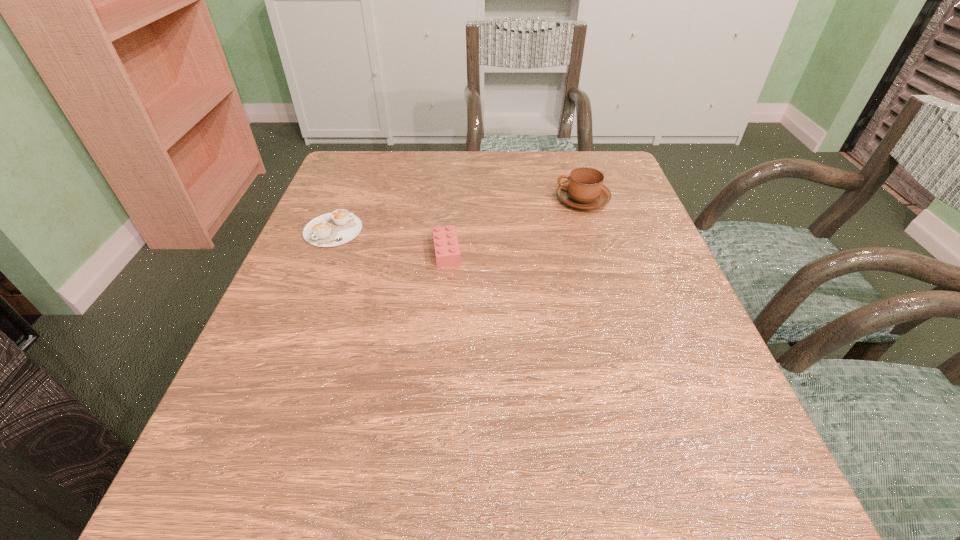
You are a GUI agent. You are given a task and a screenshot of the screen. Output one action in this format:
    pyautogui.click(x=<x>, y=<y>)
    Task: Click on the free space between the shortest object and the second object from left to right
    The width and height of the screenshot is (960, 540).
    Given the screenshot: What is the action you would take?
    pyautogui.click(x=390, y=241)

You are a GUI agent. You are given a task and a screenshot of the screen. Output one action in this format:
    pyautogui.click(x=<x>, y=<y>)
    Task: Click on the empty location between the right cappuccino and the leftmost object
    Image resolution: width=960 pixels, height=540 pixels.
    Given the screenshot: What is the action you would take?
    pyautogui.click(x=458, y=215)

Select which object appears as the closest to the Lego. Please provide its 2D coordinates. Your answer should be formatted as a tuple, i.e. [(x, y)], where the tuple contains the x and y coordinates of a point satisfying the conditions above.

[(332, 229)]

Locate which object is the second closest to the shortest object. Please provide its 2D coordinates. Your answer should be formatted as a tuple, i.e. [(x, y)], where the tuple contains the x and y coordinates of a point satisfying the conditions above.

[(584, 189)]

Find the location of a particular element. Image resolution: width=960 pixels, height=540 pixels. vacant position in the image that satisfies the following two spatial constraints: 1. on the side of the rightmost object with the handle; 2. on the front side of the second shortest object is located at coordinates (598, 251).

Locate an element on the screen. The height and width of the screenshot is (540, 960). vacant area that satisfies the following two spatial constraints: 1. on the front side of the shortest object; 2. on the right side of the second tallest object is located at coordinates (324, 251).